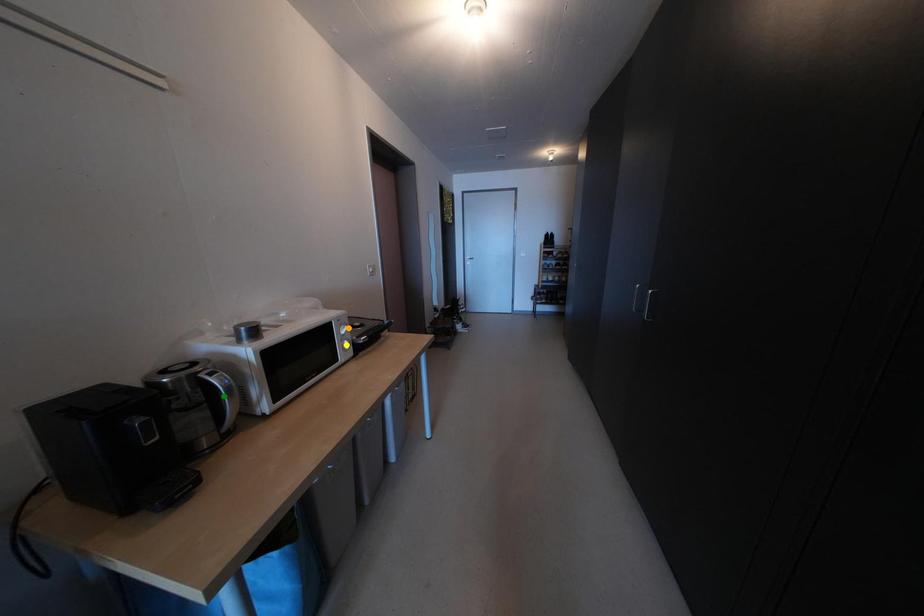
Order these from nearest to farthest:
- orange point
- yellow point
- green point

yellow point
orange point
green point